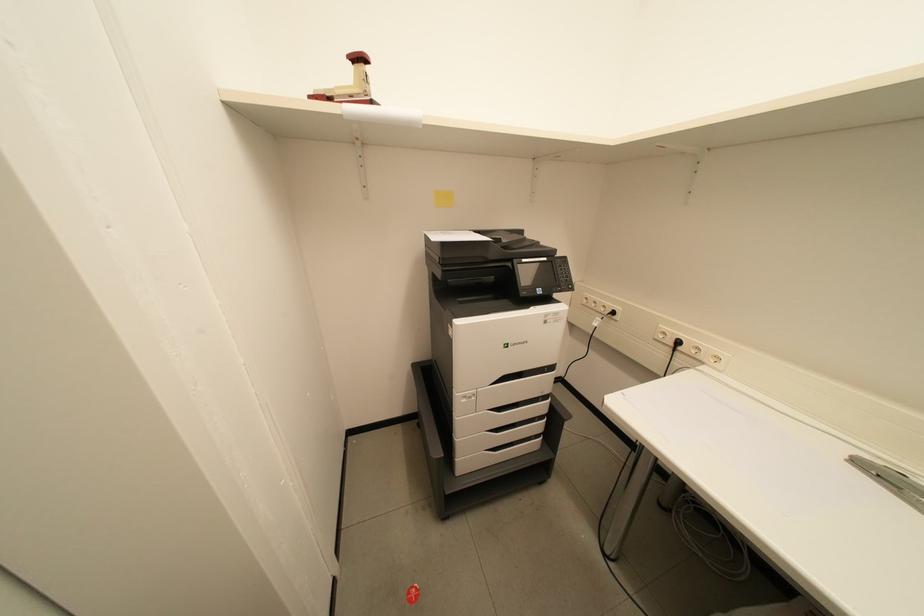
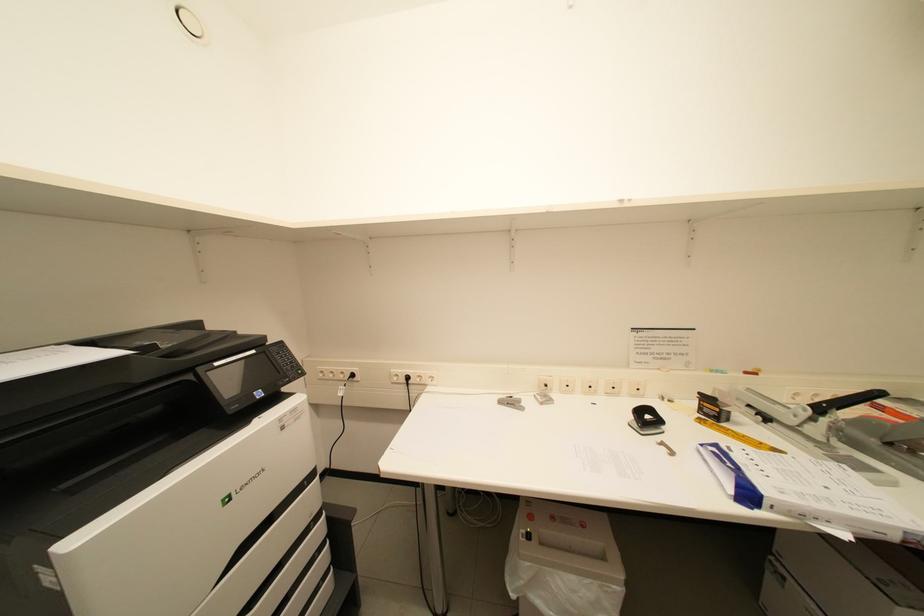
Question: Based on the continuous images, in which direction is the camera rotating? Reply with the corresponding letter.

Choices:
 (A) Left
 (B) Right
 (C) Up
 (D) Down

Answer: (B)